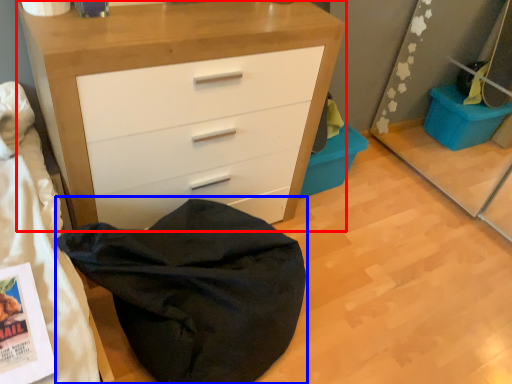
Question: Which object is closer to the camera taking this photo, chest of drawers (highlighted by a red box) or bean bag chair (highlighted by a blue box)?

Choices:
 (A) chest of drawers
 (B) bean bag chair

Answer: (B)